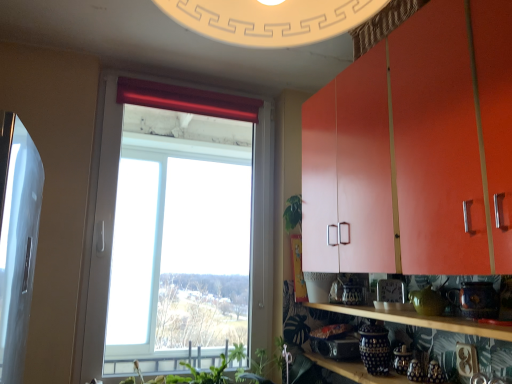
Question: Is transparent glass window at center wider or thinner than matte orange cabinet at upper right?

Choices:
 (A) wide
 (B) thin

Answer: (B)

Question: In the image, is transparent glass window at center positioned in front of or behind matte orange cabinet at upper right?

Choices:
 (A) behind
 (B) front

Answer: (A)

Question: Based on their relative distances, which object is nearer to the green leafy plant at lower center, the 1th plant viewed from the right?

Choices:
 (A) matte orange cabinet at upper right
 (B) transparent glass window at center
 (C) wooden shelf at lower right, acting as the 2th shelf starting from the bottom
 (D) red velvet curtain at upper center
 (E) green leafy plant at lower center, acting as the 1th plant starting from the left

Answer: (E)

Question: Which is farther from the transparent glass window at center?

Choices:
 (A) red velvet curtain at upper center
 (B) wooden shelf at lower right, acting as the 2th shelf starting from the bottom
 (C) green leafy plant at lower center, the 2th plant viewed from the left
 (D) matte orange cabinet at upper right
 (E) blue and white ceramic jars at lower center, positioned as the 1th shelf in bottom-to-top order

Answer: (B)